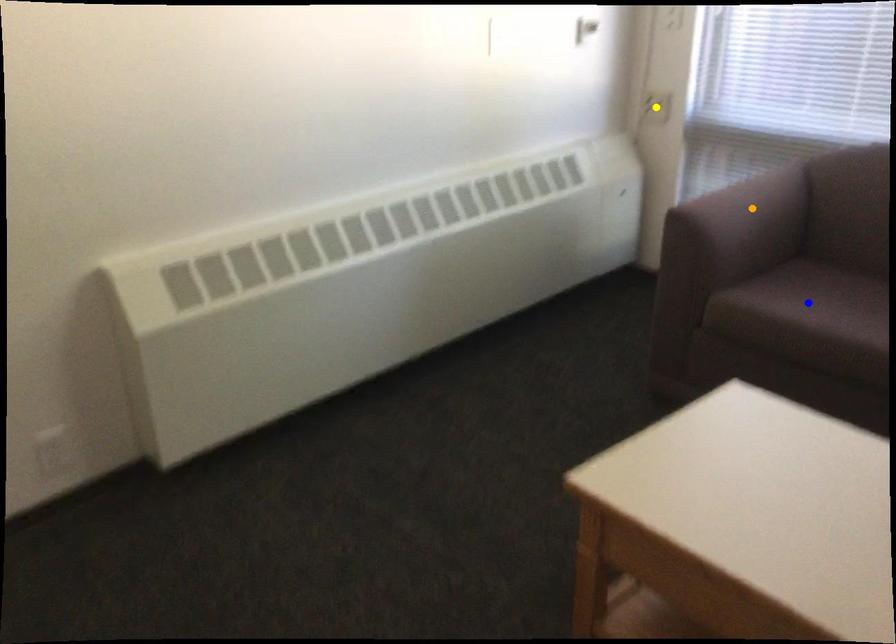
Order these from nearest to farthest:
A) blue point
B) yellow point
C) orange point

blue point
orange point
yellow point